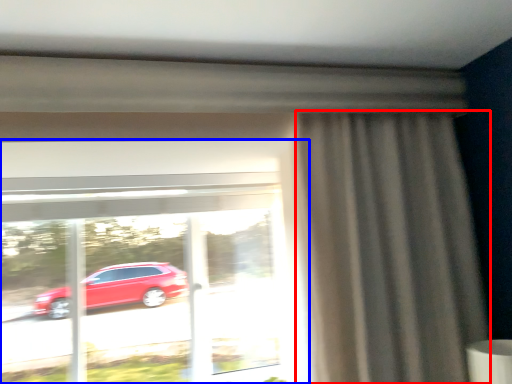
Question: Among these objects, which one is nearest to the camera, curtain (highlighted by a red box) or window (highlighted by a blue box)?

Choices:
 (A) curtain
 (B) window

Answer: (A)